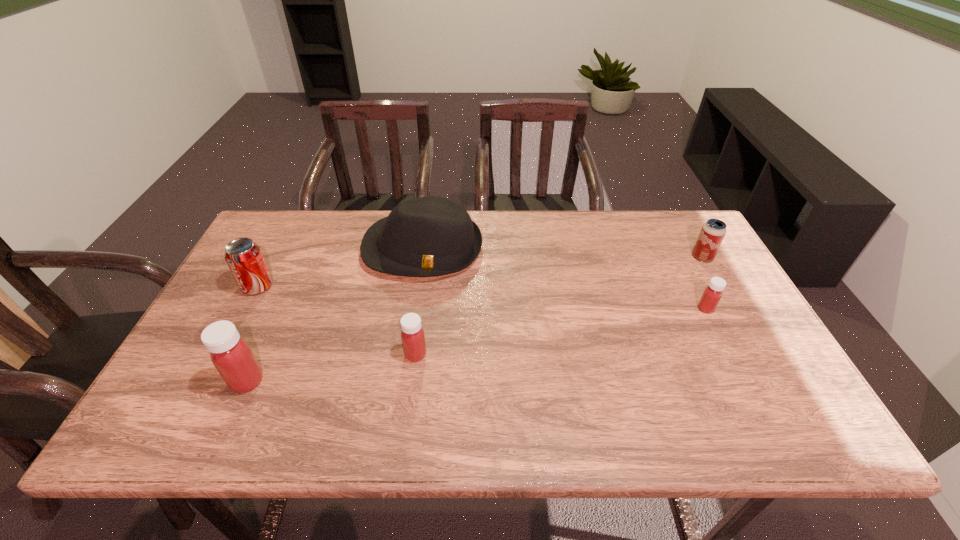
This screenshot has height=540, width=960. In order to click on the leftmost medicine in this screenshot , I will do `click(231, 355)`.

The width and height of the screenshot is (960, 540). In order to click on the nearest medicine in this screenshot , I will do `click(231, 355)`.

This screenshot has height=540, width=960. I want to click on the second tallest medicine, so (x=413, y=339).

Find the location of a particular element. Image resolution: width=960 pixels, height=540 pixels. the second nearest medicine is located at coordinates (413, 339).

Where is `the fourth farthest object`? Image resolution: width=960 pixels, height=540 pixels. the fourth farthest object is located at coordinates (712, 294).

Identify the location of the fifth object from left to right. Image resolution: width=960 pixels, height=540 pixels. (712, 294).

You are a GUI agent. You are given a task and a screenshot of the screen. Output one action in this format:
    pyautogui.click(x=<x>, y=<y>)
    Task: Click on the fedora
    The width and height of the screenshot is (960, 540).
    Given the screenshot: What is the action you would take?
    pyautogui.click(x=428, y=236)

This screenshot has height=540, width=960. What are the coordinates of `the rightmost object` in the screenshot? It's located at (712, 233).

Identify the location of the leftmost object. This screenshot has width=960, height=540. (244, 257).

In order to click on vacant area located on the left of the fifth object from right to left in this screenshot , I will do `click(209, 381)`.